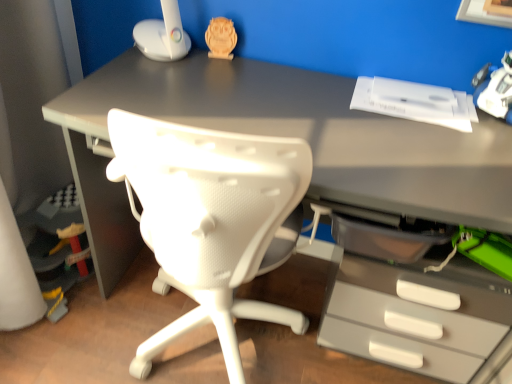
What are the coordinates of `blank space to the left of white plastic toy at upper right, the 1th toy when ordered from right to left` in the screenshot? It's located at (438, 116).